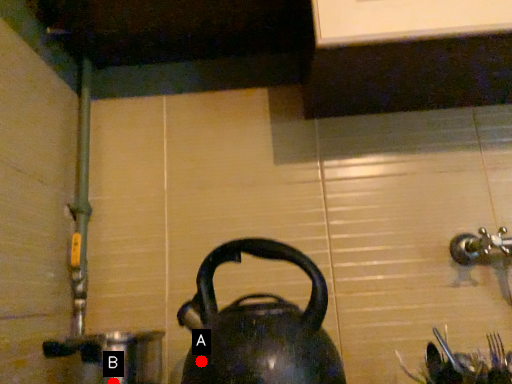
Question: Two points are circled on the image, labeled by A and B beside each circle. Which point is closer to the camera taking this photo?

Choices:
 (A) A is closer
 (B) B is closer

Answer: (A)